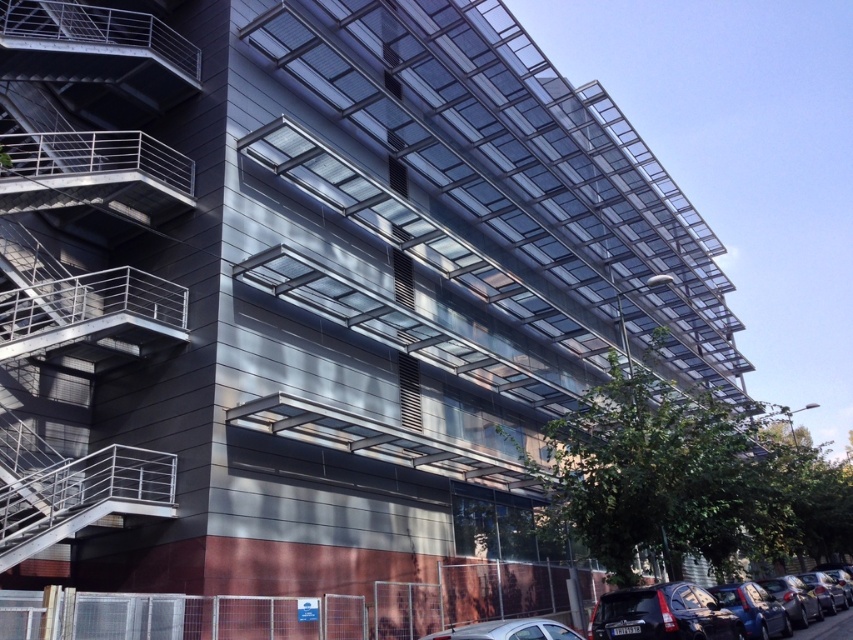
You are a pedestrian standing in front of the modern building. You see a metallic blue car at lower right and a metallic silver car at lower center. Which car is positioned to the right side of the other?

The metallic blue car at lower right is positioned to the right of the metallic silver car at lower center.

You are a delivery driver who needs to park your 2.5 meter wide truck between the metallic blue car at lower right and the metallic silver car at lower center. Can you fit your truck in that space?

The space between the metallic blue car at lower right and the metallic silver car at lower center is 5.30 meters. Since your truck is 2.5 meters wide, there is enough space to park it between them.

You are a delivery person trying to park your vehicle in the parking area near the building. You see a metallic blue car at lower right and a metallic silver car at lower center. Which car is parked closer to the staircase on the left side of the building?

The metallic silver car at lower center is closer to the staircase on the left side of the building because it is positioned lower than the metallic blue car at lower right, which is above it.